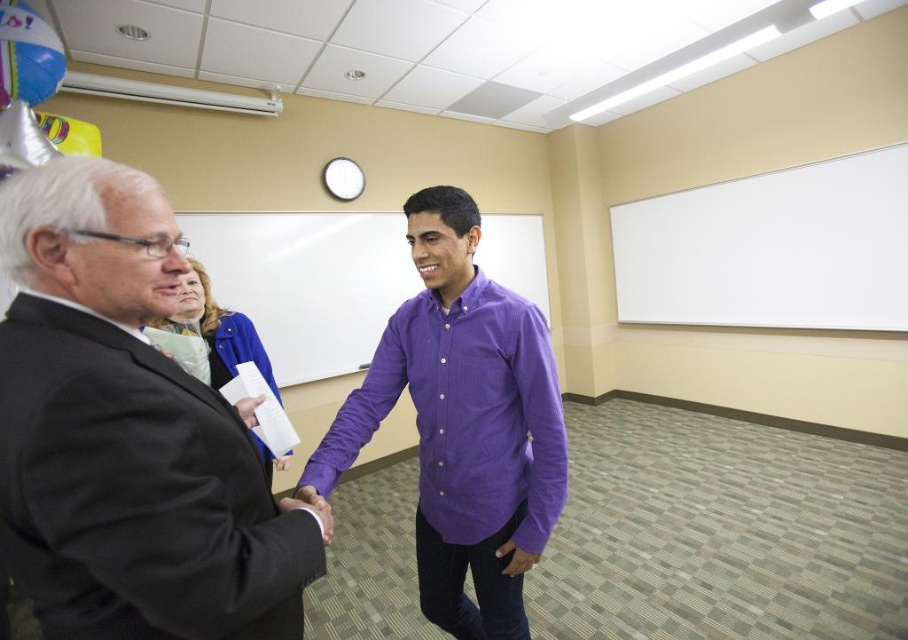
You are an interior designer planning to place a new poster on the wall between the white matte board at upper right and the purple cotton shirt at center. Considering their widths, which object should the poster be placed closer to to ensure it doesn

The white matte board at upper right is wider than the purple cotton shirt at center. Therefore, the poster should be placed closer to the white matte board at upper right to account for its larger width.